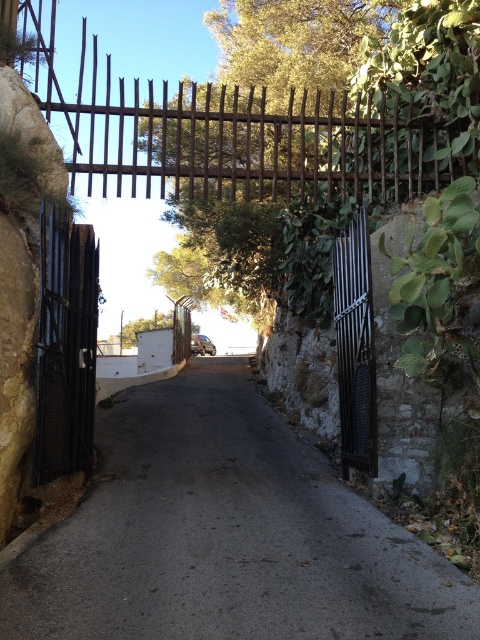
You are a delivery person with a cart that is 2 meters wide. You need to navigate through the gates to reach the delivery area. Can your cart fit through the space between the black metal gate at left and the polished metal gate at center?

The black metal gate at left and polished metal gate at center are 3.33 meters apart from each other. Since your cart is 2 meters wide, it can easily fit through the 3.33 meter gap between the two gates.

You are driving a delivery truck that is 2.5 meters wide. You come across the dark asphalt road at center and the polished metal gate at center. Can your truck pass through the gate without any modifications?

The dark asphalt road at center is bigger than polished metal gate at center, so the truck cannot pass through the gate as the gate is narrower than the road and the truck is 2.5 meters wide.